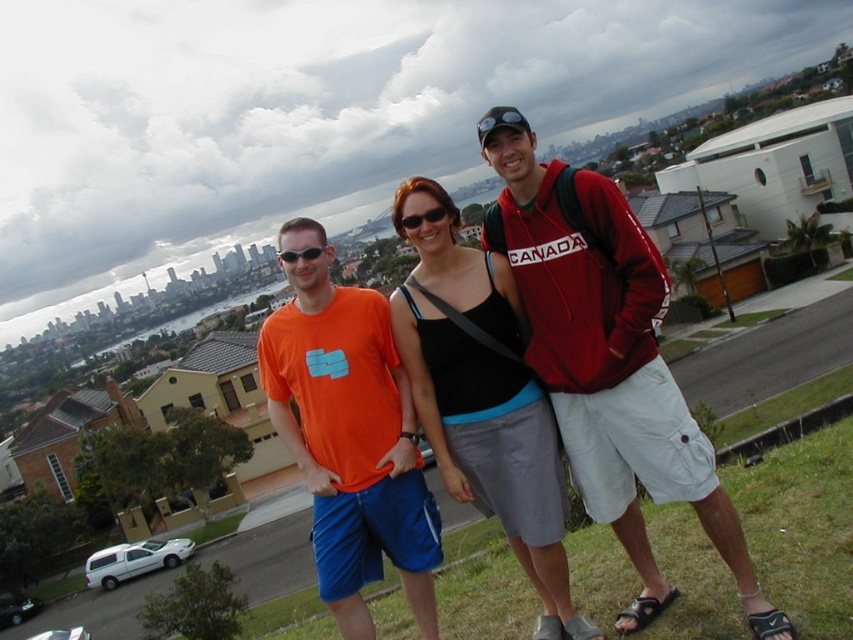
Question: Is orange t-shirt at center closer to the viewer compared to black matte tank top at center?

Choices:
 (A) yes
 (B) no

Answer: (B)

Question: Among these points, which one is nearest to the camera?

Choices:
 (A) (450, 387)
 (B) (393, 404)

Answer: (A)

Question: Which of the following is the farthest from the observer?

Choices:
 (A) (405, 593)
 (B) (412, 182)

Answer: (A)

Question: Among these points, which one is nearest to the camera?

Choices:
 (A) (370, 365)
 (B) (457, 344)
 (C) (639, 568)

Answer: (C)

Question: Can you confirm if red cotton hoodie at center is positioned to the left of orange t-shirt at center?

Choices:
 (A) yes
 (B) no

Answer: (B)

Question: Does red cotton hoodie at center appear over black matte tank top at center?

Choices:
 (A) no
 (B) yes

Answer: (B)